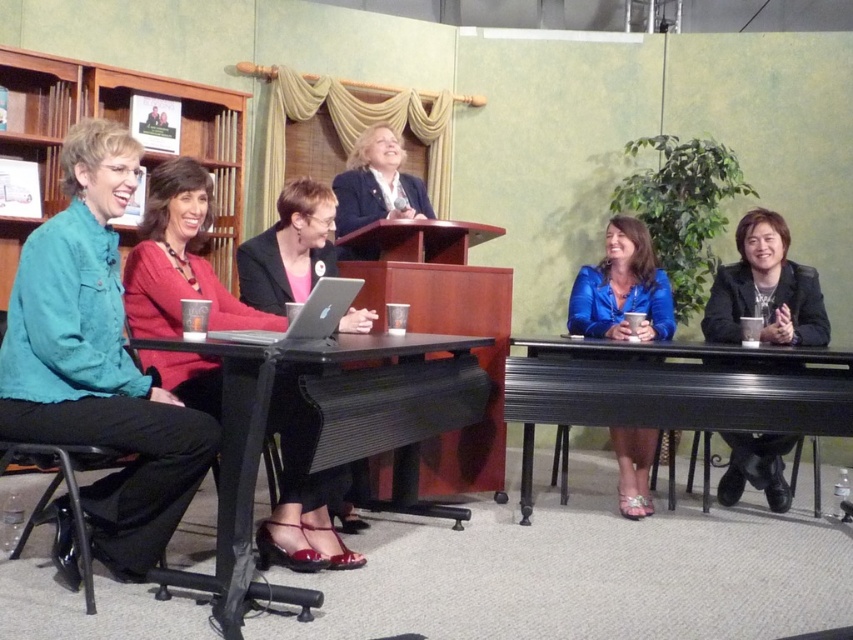
Question: Is teal denim jacket at left bigger than matte black blazer at center?

Choices:
 (A) no
 (B) yes

Answer: (B)

Question: Which point appears closest to the camera in this image?

Choices:
 (A) (744, 257)
 (B) (608, 278)

Answer: (A)

Question: Does teal denim jacket at left appear under matte black blazer at center?

Choices:
 (A) yes
 (B) no

Answer: (A)

Question: Considering the relative positions of black metal table at lower right and silver metallic laptop at center in the image provided, where is black metal table at lower right located with respect to silver metallic laptop at center?

Choices:
 (A) right
 (B) left

Answer: (A)

Question: Which point is closer to the camera taking this photo?

Choices:
 (A) (311, 301)
 (B) (657, 429)
 (C) (305, 454)
 (D) (369, 212)

Answer: (A)

Question: Which of the following is the farthest from the observer?

Choices:
 (A) (474, 364)
 (B) (762, 403)
 (C) (619, 227)

Answer: (C)